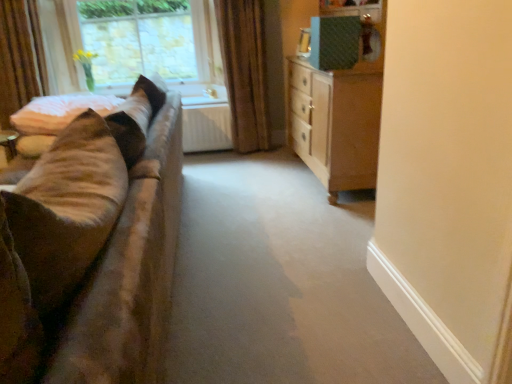
Question: From a real-world perspective, is soft beige fabric at left over brown fabric curtain at upper center?

Choices:
 (A) yes
 (B) no

Answer: (B)

Question: Are soft beige fabric at left and brown fabric curtain at upper center far apart?

Choices:
 (A) yes
 (B) no

Answer: (A)

Question: Considering the relative positions of soft beige fabric at left and brown fabric curtain at upper center in the image provided, is soft beige fabric at left to the left of brown fabric curtain at upper center from the viewer's perspective?

Choices:
 (A) no
 (B) yes

Answer: (B)

Question: From a real-world perspective, is soft beige fabric at left physically below brown fabric curtain at upper center?

Choices:
 (A) yes
 (B) no

Answer: (A)

Question: Is the depth of soft beige fabric at left greater than that of brown fabric curtain at upper center?

Choices:
 (A) no
 (B) yes

Answer: (A)

Question: From a real-world perspective, is velvet brown couch at left above or below brown fabric curtain at upper center?

Choices:
 (A) below
 (B) above

Answer: (A)

Question: Is velvet brown couch at left to the left or to the right of brown fabric curtain at upper center in the image?

Choices:
 (A) left
 (B) right

Answer: (A)

Question: Considering the positions of velvet brown couch at left and brown fabric curtain at upper center in the image, is velvet brown couch at left wider or thinner than brown fabric curtain at upper center?

Choices:
 (A) wide
 (B) thin

Answer: (A)

Question: Is velvet brown couch at left inside or outside of brown fabric curtain at upper center?

Choices:
 (A) inside
 (B) outside

Answer: (B)

Question: Visually, is velvet brown couch at left positioned to the left or to the right of wooden chest of drawers at right?

Choices:
 (A) left
 (B) right

Answer: (A)

Question: Choose the correct answer: Is velvet brown couch at left inside wooden chest of drawers at right or outside it?

Choices:
 (A) inside
 (B) outside

Answer: (B)

Question: From the image's perspective, is velvet brown couch at left located above or below wooden chest of drawers at right?

Choices:
 (A) above
 (B) below

Answer: (B)

Question: Looking at the image, does velvet brown couch at left seem bigger or smaller compared to wooden chest of drawers at right?

Choices:
 (A) big
 (B) small

Answer: (A)

Question: Is point (168, 62) positioned closer to the camera than point (260, 6)?

Choices:
 (A) farther
 (B) closer

Answer: (A)

Question: Looking at the image, does clear glass window at upper left seem bigger or smaller compared to brown fabric curtain at upper center?

Choices:
 (A) big
 (B) small

Answer: (B)